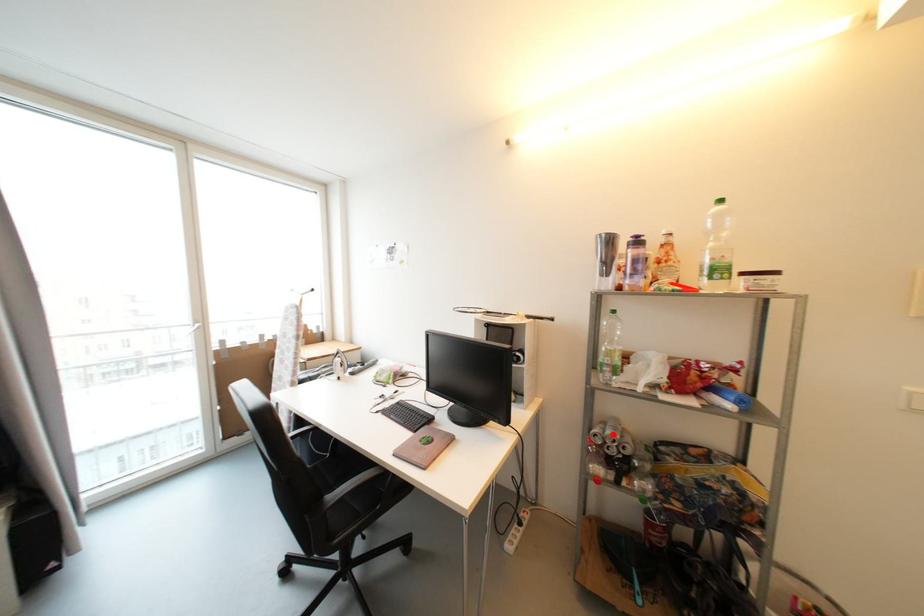
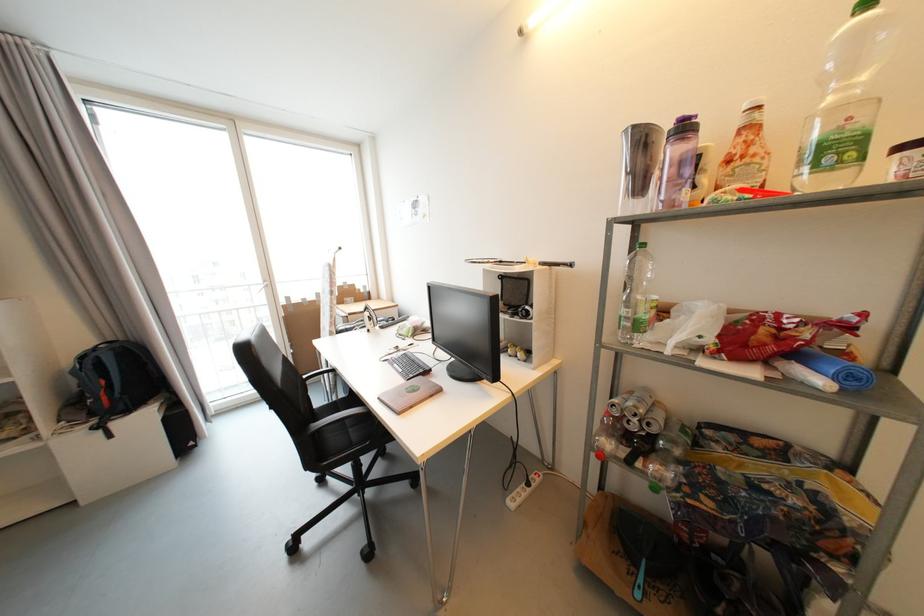
The point at the highlighted location is marked in the first image. Where is the corresponding point in the second image?

(635, 406)